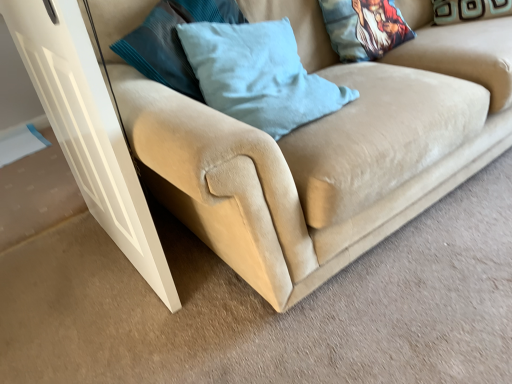
At what (x,y) coordinates should I click in order to perform the action: click on vacant area that is in front of white glossy door at lower left. Please return your answer as a coordinate pair (x, y). The width and height of the screenshot is (512, 384). Looking at the image, I should click on (125, 329).